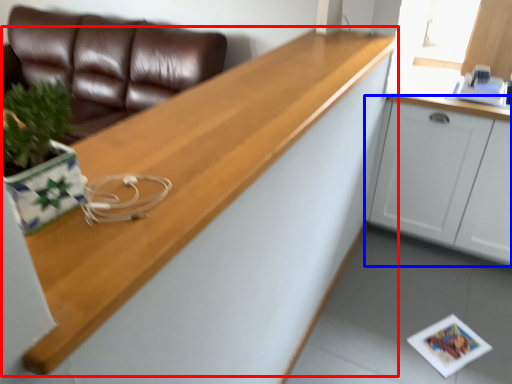
Question: Which object is closer to the camera taking this photo, countertop (highlighted by a red box) or cabinetry (highlighted by a blue box)?

Choices:
 (A) countertop
 (B) cabinetry

Answer: (A)